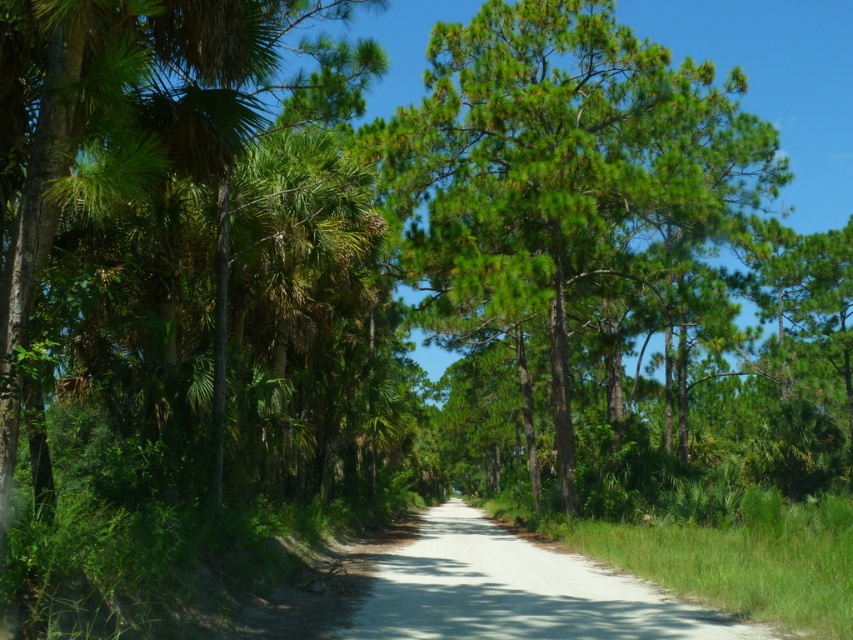
You are a hiker standing at the point marked by the coordinates point (563, 180). You see a dirt path winding through a lush forest. Which direction should you walk to stay on the dirt path?

The dirt path is at the center of the scene, so walking towards the center will keep you on the dirt path.